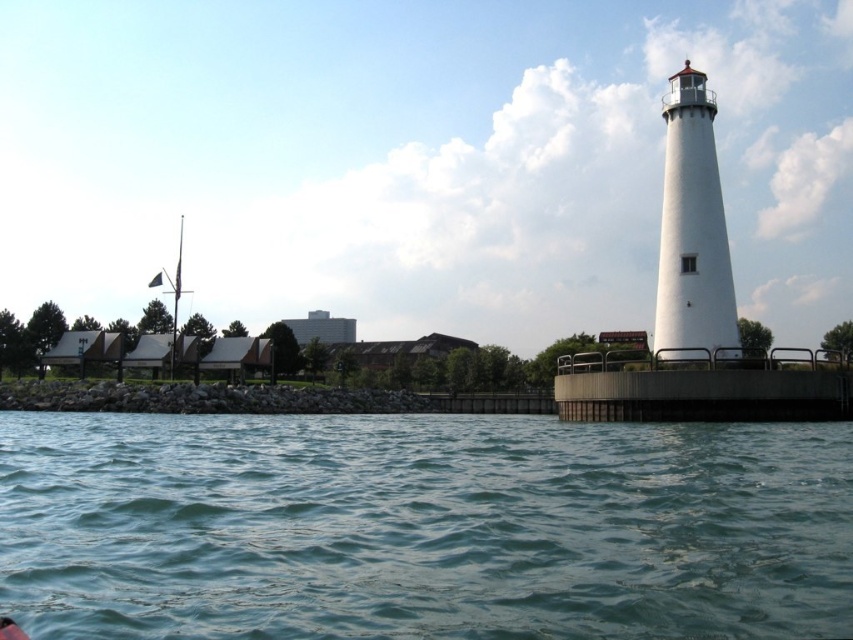
Does point (397, 548) come in front of point (694, 259)?

Yes, point (397, 548) is in front of point (694, 259).

Is greenish-blue water at lower center taller than white smooth lighthouse at right?

Incorrect, greenish-blue water at lower center's height is not larger of white smooth lighthouse at right's.

Who is more forward, (309, 516) or (669, 173)?

Point (309, 516)

Locate an element on the screen. This screenshot has width=853, height=640. greenish-blue water at lower center is located at coordinates 422,528.